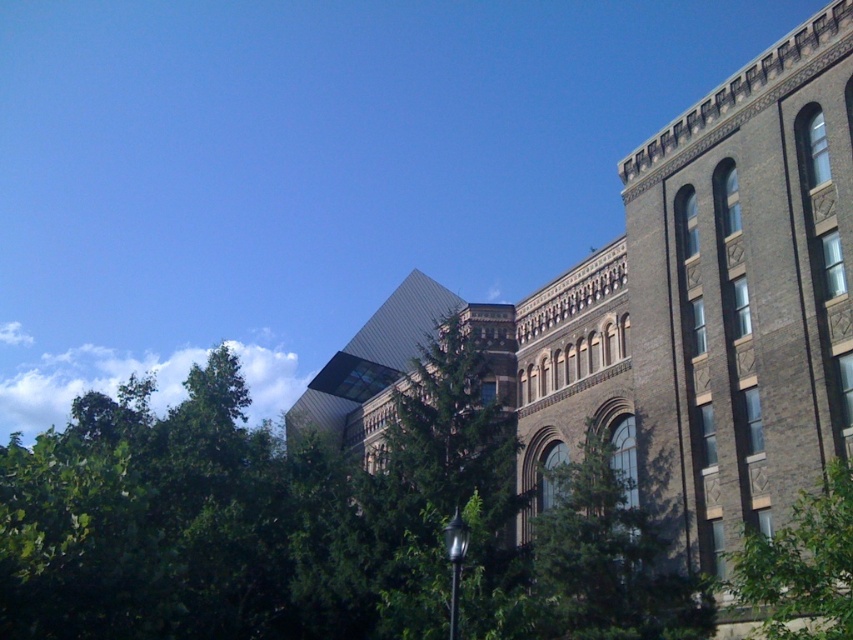
Question: Where is green leafy tree at center located in relation to green leafy tree at lower right in the image?

Choices:
 (A) left
 (B) right

Answer: (A)

Question: Does green leafy tree at center come in front of green leafy tree at lower right?

Choices:
 (A) no
 (B) yes

Answer: (A)

Question: Where is green leafy tree at center located in relation to green leafy tree at lower right in the image?

Choices:
 (A) above
 (B) below

Answer: (B)